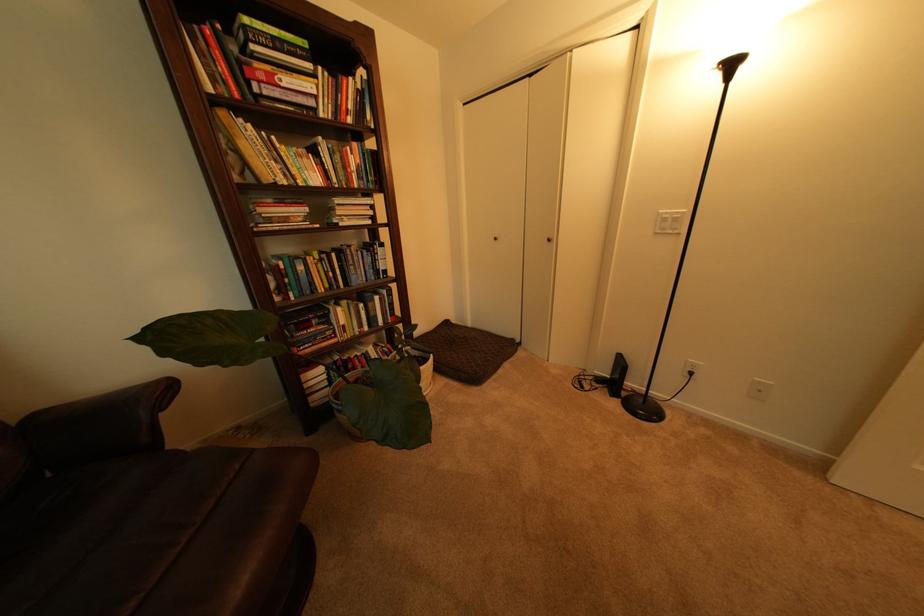
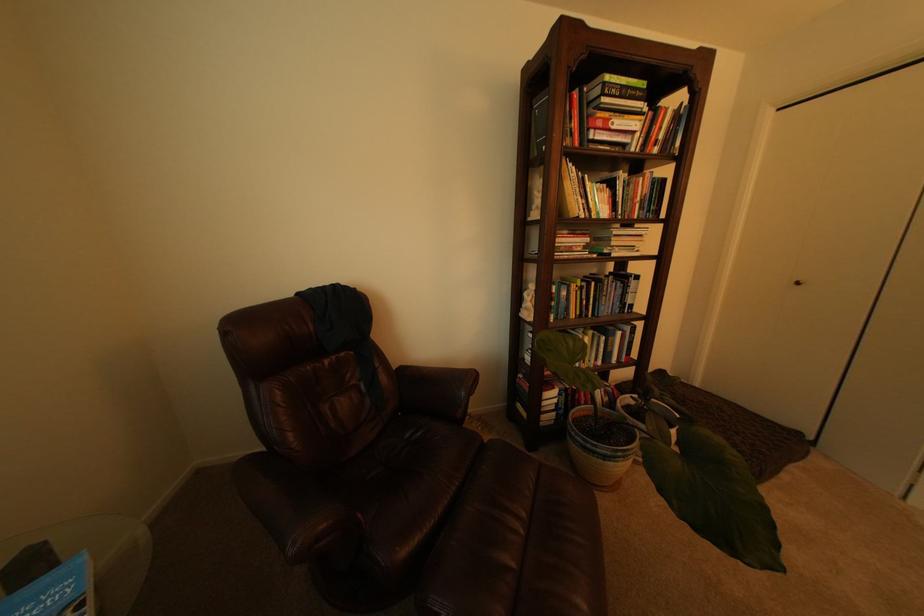
Question: The camera is either moving clockwise (left) or counter-clockwise (right) around the object. The first image is from the beginning of the video and the second image is from the end. Is the camera moving left or right when shooting the video?

Choices:
 (A) Left
 (B) Right

Answer: (B)